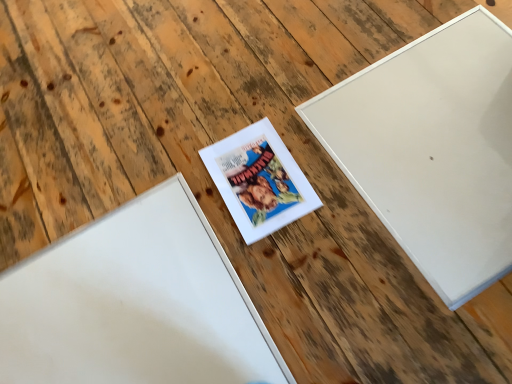
At what (x,y) coordinates should I click in order to perform the action: click on vacant area to the right of white matte picture frame at center, which is the second picture frame from left to right. Please return your answer as a coordinate pair (x, y). This screenshot has width=512, height=384. Looking at the image, I should click on (346, 152).